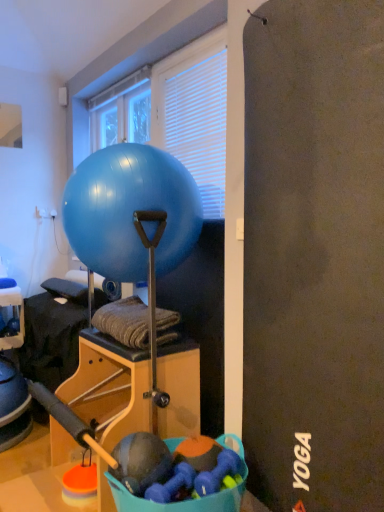
Question: Is blue glossy exercise ball at center at the back of white blinds at upper center?

Choices:
 (A) yes
 (B) no

Answer: (B)

Question: Is the position of white blinds at upper center more distant than that of blue glossy exercise ball at center?

Choices:
 (A) yes
 (B) no

Answer: (A)

Question: From a real-world perspective, does white blinds at upper center sit lower than blue glossy exercise ball at center?

Choices:
 (A) yes
 (B) no

Answer: (B)

Question: Is white blinds at upper center facing towards blue glossy exercise ball at center?

Choices:
 (A) no
 (B) yes

Answer: (B)

Question: From the image's perspective, would you say white blinds at upper center is positioned over blue glossy exercise ball at center?

Choices:
 (A) no
 (B) yes

Answer: (B)

Question: From a real-world perspective, is blue glossy exercise ball at center positioned above or below white blinds at upper center?

Choices:
 (A) below
 (B) above

Answer: (A)

Question: In terms of height, does blue glossy exercise ball at center look taller or shorter compared to white blinds at upper center?

Choices:
 (A) short
 (B) tall

Answer: (A)

Question: From the image's perspective, is blue glossy exercise ball at center above or below white blinds at upper center?

Choices:
 (A) above
 (B) below

Answer: (B)

Question: Visually, is blue glossy exercise ball at center positioned to the left or to the right of white blinds at upper center?

Choices:
 (A) left
 (B) right

Answer: (A)

Question: Based on their positions, is transparent glass window at upper center located to the left or right of blue glossy exercise ball at center?

Choices:
 (A) right
 (B) left

Answer: (B)

Question: Looking at their shapes, would you say transparent glass window at upper center is wider or thinner than blue glossy exercise ball at center?

Choices:
 (A) wide
 (B) thin

Answer: (B)

Question: Relative to blue glossy exercise ball at center, is transparent glass window at upper center in front or behind?

Choices:
 (A) front
 (B) behind

Answer: (B)

Question: Is point (142, 97) positioned closer to the camera than point (130, 172)?

Choices:
 (A) farther
 (B) closer

Answer: (A)

Question: In terms of size, does blue glossy exercise ball at center appear bigger or smaller than transparent glass window at upper center?

Choices:
 (A) small
 (B) big

Answer: (B)

Question: From a real-world perspective, relative to transparent glass window at upper center, is blue glossy exercise ball at center vertically above or below?

Choices:
 (A) above
 (B) below

Answer: (B)